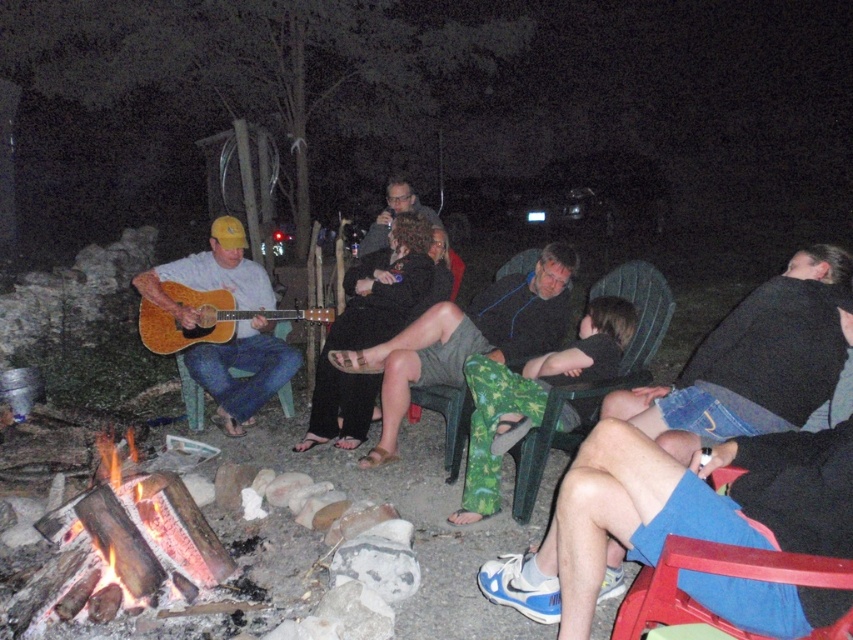
You are a photographer standing near the campfire and want to take a photo of the green textured shorts at center and the matte black shirt at center. Which object will appear larger in the photo?

The green textured shorts at center will appear larger in the photo because it is closer to the viewer than the matte black shirt at center.

You are a photographer setting up a tripod to capture the scene. You need to position it so that the charcoal wood fire at lower left and the wooden acoustic guitar at left are both visible in the frame. Considering their sizes, which object should you place closer to the center of the frame to ensure both are fully visible?

The charcoal wood fire at lower left is thinner than the wooden acoustic guitar at left, so to ensure both are fully visible, the wooden acoustic guitar at left should be placed closer to the center of the frame since it is wider.

You are planning to take a photo of the nighttime campfire scene. You want to ensure both the charcoal wood fire at lower left and the matte black shirt at center are clearly visible. Considering their sizes, which object might require more careful lighting adjustments to avoid being too dark or too bright?

The charcoal wood fire at lower left has a smaller size compared to the matte black shirt at center, so it might require more careful lighting adjustments to avoid being too bright or washed out, while the larger matte black shirt at center could be easier to balance in terms of exposure.